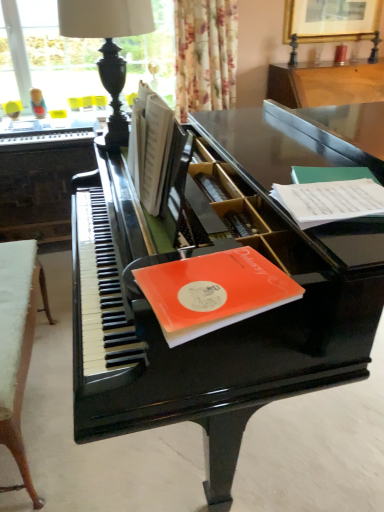
This screenshot has height=512, width=384. I want to click on orange matte paper at piano top, which ranks as the second paperback book in back-to-front order, so coord(213,291).

The width and height of the screenshot is (384, 512). What do you see at coordinates (17, 348) in the screenshot?
I see `white fabric stool at lower left, placed as the first table when sorted from front to back` at bounding box center [17, 348].

What do you see at coordinates (149, 144) in the screenshot? I see `white paper book at center` at bounding box center [149, 144].

Identify the location of white paper book at center. (149, 144).

Find the location of a particular element. The width and height of the screenshot is (384, 512). glossy black piano at center is located at coordinates (225, 327).

I want to click on black polished wood table lamp at upper left, so click(x=108, y=47).

Measure the distance between black polished wood table lamp at upper left and camera.

A distance of 4.87 feet exists between black polished wood table lamp at upper left and camera.

This screenshot has height=512, width=384. Find the location of `floral fabric curtain at upper center`. floral fabric curtain at upper center is located at coordinates (205, 55).

Is black polished wood table lamp at upper left smaller than black polished piano at left, the second table from the bottom?

Correct, black polished wood table lamp at upper left occupies less space than black polished piano at left, the second table from the bottom.

Where is `table lying behind the black polished wood table lamp at upper left`? table lying behind the black polished wood table lamp at upper left is located at coordinates (43, 176).

Is black polished wood table lamp at upper left taller than black polished piano at left, the second table from the bottom?

No.

Considering the points (91, 35) and (31, 168), which point is behind, point (91, 35) or point (31, 168)?

The point (31, 168) is behind.

Between white paper book at center and white fabric stool at lower left, the first table positioned from the bottom, which one has smaller size?

Smaller between the two is white paper book at center.

From the image's perspective, which object appears higher, white paper book at center or white fabric stool at lower left, the first table positioned from the bottom?

white paper book at center.

Consider the image. Is white paper book at center not within white fabric stool at lower left, the first table positioned from the bottom?

Yes, white paper book at center is located beyond the bounds of white fabric stool at lower left, the first table positioned from the bottom.

Is white paper book at center next to white fabric stool at lower left, placed as the first table when sorted from front to back?

→ No, white paper book at center is not touching white fabric stool at lower left, placed as the first table when sorted from front to back.

Which of these two, black polished piano at left, marked as the first table in a back-to-front arrangement, or white paper book at center, stands taller?

Standing taller between the two is black polished piano at left, marked as the first table in a back-to-front arrangement.

Is black polished piano at left, arranged as the 2th table when viewed from the front, looking in the opposite direction of white paper book at center?

No, black polished piano at left, arranged as the 2th table when viewed from the front, is not facing the opposite direction of white paper book at center.

Which is nearer, (83, 141) or (150, 135)?

Point (83, 141).

From a real-world perspective, is black polished piano at left, which is the 1th table from top to bottom, above or below white paper book at center?

Answer: black polished piano at left, which is the 1th table from top to bottom, is below white paper book at center.

Based on the photo, is black polished wood table lamp at upper left not near white paper at right, the second paperback book positioned from the left?

No, there isn't a large distance between black polished wood table lamp at upper left and white paper at right, the second paperback book positioned from the left.

From a real-world perspective, between black polished wood table lamp at upper left and white paper at right, the second paperback book positioned from the left, who is vertically higher?

black polished wood table lamp at upper left, from a real-world perspective.

Consider the image. Is white paper at right, marked as the second paperback book in a front-to-back arrangement, at the back of black polished wood table lamp at upper left?

No, black polished wood table lamp at upper left's orientation is not away from white paper at right, marked as the second paperback book in a front-to-back arrangement.

Which point is more forward, (x=107, y=125) or (x=319, y=194)?

The point (x=319, y=194) is closer to the camera.

Is orange matte paper at piano top, which is the first paperback book from left to right, wider than black polished wood table lamp at upper left?

No.

Is orange matte paper at piano top, which is the first paperback book from left to right, oriented away from black polished wood table lamp at upper left?

No, orange matte paper at piano top, which is the first paperback book from left to right, is not facing away from black polished wood table lamp at upper left.

Considering the sizes of objects orange matte paper at piano top, which is the first paperback book from front to back, and black polished wood table lamp at upper left in the image provided, who is bigger, orange matte paper at piano top, which is the first paperback book from front to back, or black polished wood table lamp at upper left?

Bigger between the two is black polished wood table lamp at upper left.

Would you say orange matte paper at piano top, which is the first paperback book from left to right, is outside black polished wood table lamp at upper left?

Yes, orange matte paper at piano top, which is the first paperback book from left to right, is not within black polished wood table lamp at upper left.

Considering the sizes of objects white paper book at center and black polished wood table lamp at upper left in the image provided, who is taller, white paper book at center or black polished wood table lamp at upper left?

With more height is black polished wood table lamp at upper left.

Is white paper book at center to the left of black polished wood table lamp at upper left from the viewer's perspective?

In fact, white paper book at center is to the right of black polished wood table lamp at upper left.

Looking at this image, who is bigger, white paper book at center or black polished wood table lamp at upper left?

Bigger between the two is black polished wood table lamp at upper left.

Is the position of white paper book at center less distant than that of black polished wood table lamp at upper left?

Yes, white paper book at center is in front of black polished wood table lamp at upper left.

Considering the relative positions of white paper book at center and white paper at right, which is the second paperback book from bottom to top, in the image provided, is white paper book at center to the left or to the right of white paper at right, which is the second paperback book from bottom to top,?

In the image, white paper book at center appears on the left side of white paper at right, which is the second paperback book from bottom to top.

Considering the sizes of white paper book at center and white paper at right, the second paperback book positioned from the left, in the image, is white paper book at center taller or shorter than white paper at right, the second paperback book positioned from the left,?

Considering their sizes, white paper book at center has more height than white paper at right, the second paperback book positioned from the left.

Is white paper book at center positioned beyond the bounds of white paper at right, acting as the 1th paperback book starting from the top?

Yes.

Based on the photo, which is nearer, (148, 207) or (304, 173)?

Point (148, 207).

Find the location of `table lamp in front of the black polished piano at left, which is the 1th table from top to bottom`. table lamp in front of the black polished piano at left, which is the 1th table from top to bottom is located at coordinates (108, 47).

Find the location of a particular element. The height and width of the screenshot is (512, 384). the 1st table to the left when counting from the white paper book at center is located at coordinates (17, 348).

Which object lies nearer to the anchor point white paper book at center, orange matte paper at piano top, placed as the 2th paperback book when sorted from right to left, or white fabric stool at lower left, which is the second table from back to front?

orange matte paper at piano top, placed as the 2th paperback book when sorted from right to left, is positioned closer to the anchor white paper book at center.

When comparing their distances from orange matte paper at piano top, placed as the 2th paperback book when sorted from right to left, does white fabric stool at lower left, which is the second table from back to front, or white paper book at center seem closer?

white paper book at center lies closer to orange matte paper at piano top, placed as the 2th paperback book when sorted from right to left, than the other object.

Which object lies further to the anchor point black polished wood table lamp at upper left, orange matte paper at piano top, positioned as the 2th paperback book in top-to-bottom order, or glossy black piano at center?

orange matte paper at piano top, positioned as the 2th paperback book in top-to-bottom order, is further to black polished wood table lamp at upper left.

Which object lies further to the anchor point floral fabric curtain at upper center, black polished piano at left, which is the 1th table from top to bottom, or white fabric stool at lower left, placed as the first table when sorted from front to back?

white fabric stool at lower left, placed as the first table when sorted from front to back, lies further to floral fabric curtain at upper center than the other object.

From the image, which object appears to be farther from glossy black piano at center, orange matte paper at piano top, which is the first paperback book from left to right, or floral fabric curtain at upper center?

floral fabric curtain at upper center lies further to glossy black piano at center than the other object.

Considering their positions, is white fabric stool at lower left, which is counted as the 2th table, starting from the top, positioned further to orange matte paper at piano top, positioned as the 2th paperback book in top-to-bottom order, than floral fabric curtain at upper center?

The object further to orange matte paper at piano top, positioned as the 2th paperback book in top-to-bottom order, is floral fabric curtain at upper center.

Considering their positions, is white paper book at center positioned further to floral fabric curtain at upper center than glossy black piano at center?

Based on the image, glossy black piano at center appears to be further to floral fabric curtain at upper center.

Based on their spatial positions, is black polished piano at left, arranged as the 2th table when viewed from the front, or white fabric stool at lower left, placed as the first table when sorted from front to back, closer to white paper at right, acting as the 1th paperback book starting from the top?

white fabric stool at lower left, placed as the first table when sorted from front to back, lies closer to white paper at right, acting as the 1th paperback book starting from the top, than the other object.

The height and width of the screenshot is (512, 384). What are the coordinates of `table lamp between white fabric stool at lower left, which is the second table from back to front, and black polished piano at left, which is the 1th table from top to bottom, in the front-back direction` in the screenshot? It's located at (108, 47).

Find the location of a particular element. table lamp between orange matte paper at piano top, placed as the 2th paperback book when sorted from right to left, and black polished piano at left, which is the 1th table from top to bottom, from front to back is located at coordinates (108, 47).

Find the location of a particular element. book between black polished wood table lamp at upper left and orange matte paper at piano top, positioned as the 2th paperback book in top-to-bottom order, in the vertical direction is located at coordinates (149, 144).

Image resolution: width=384 pixels, height=512 pixels. I want to click on table between glossy black piano at center and black polished piano at left, which is the 1th table from top to bottom, from front to back, so click(x=17, y=348).